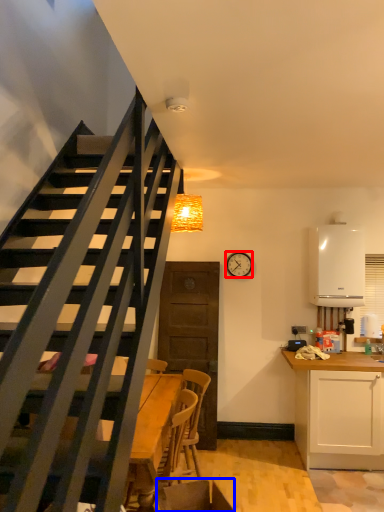
Question: Which of the following is the closest to the observer, clock (highlighted by a red box) or swivel chair (highlighted by a blue box)?

Choices:
 (A) clock
 (B) swivel chair

Answer: (B)